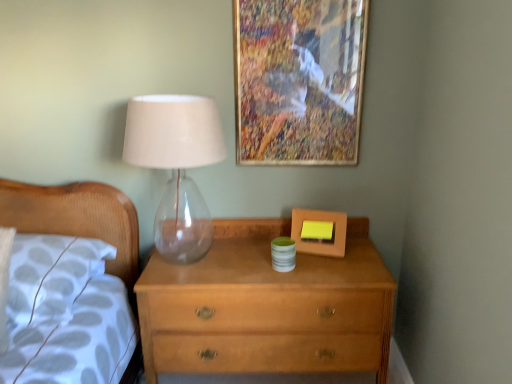
Find the location of a particular element. vacant space situated on the left part of matte wooden picture frame at center, the 2th picture frame in the top-to-bottom sequence is located at coordinates pyautogui.click(x=270, y=252).